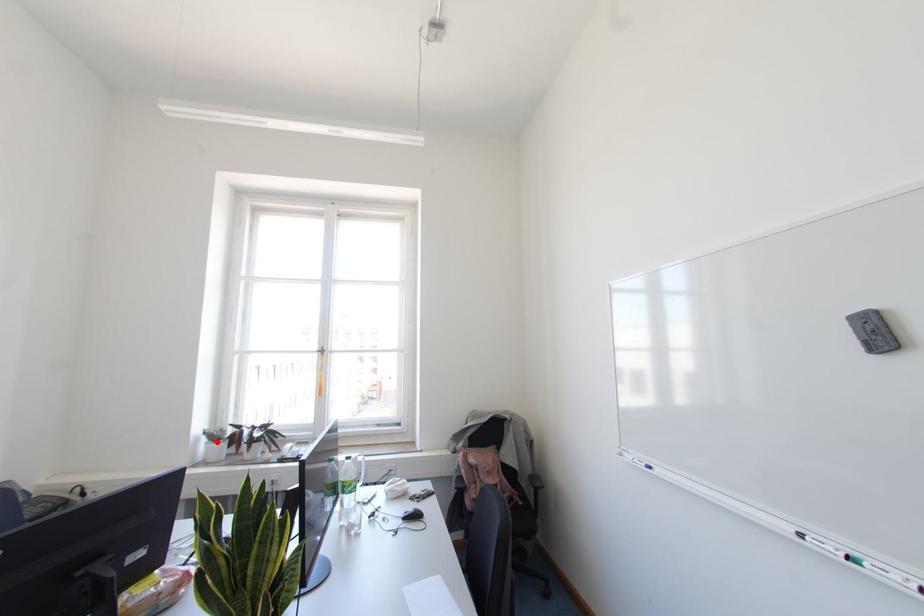
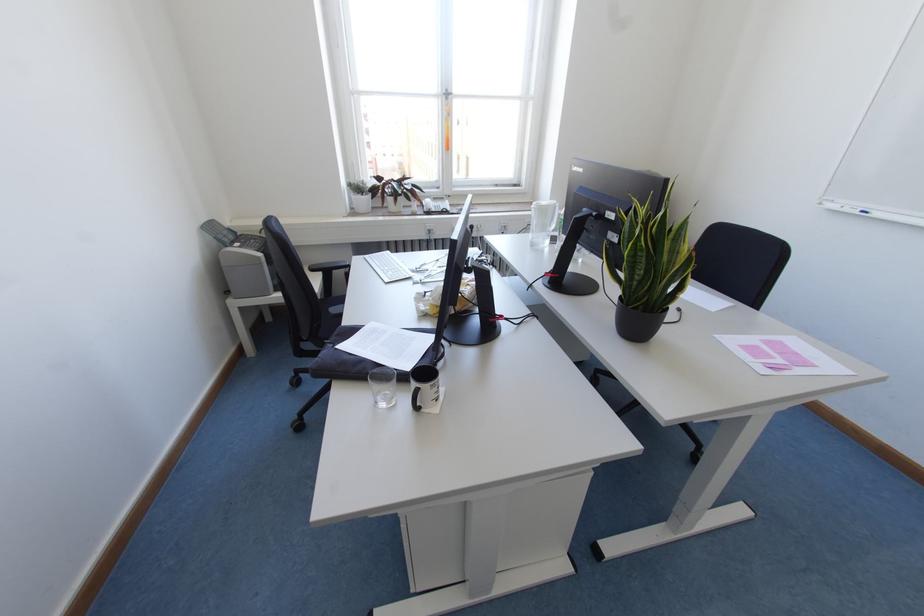
Question: I am providing you with two images of the same scene from different viewpoints. A red point is shown in image1. For the corresponding object point in image2, is it positioned nearer or farther from the camera?

Choices:
 (A) Nearer
 (B) Farther

Answer: (A)